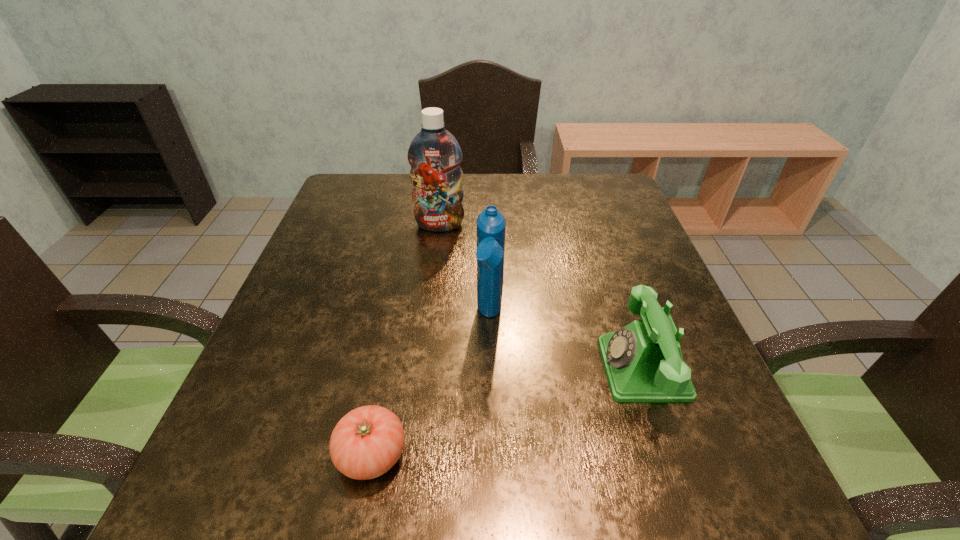
Locate an element on the screen. The height and width of the screenshot is (540, 960). vacant space at the near left corner of the desktop is located at coordinates (290, 513).

In order to click on vacant space in between the rightmost object and the farthest object in this screenshot , I will do `click(541, 297)`.

The width and height of the screenshot is (960, 540). I want to click on free space between the rightmost object and the tomato, so click(x=507, y=411).

Locate an element on the screen. The image size is (960, 540). vacant space that's between the third tallest object and the tomato is located at coordinates (507, 411).

Identify the location of free spot between the farther shampoo and the tomato. (406, 340).

Identify the location of vacant point located between the farthest object and the third tallest object. (541, 297).

Where is `vacant point located between the second shortest object and the shorter shampoo`? vacant point located between the second shortest object and the shorter shampoo is located at coordinates [x=566, y=342].

Image resolution: width=960 pixels, height=540 pixels. In order to click on free space between the tomato and the rightmost object in this screenshot , I will do `click(507, 411)`.

Find the location of a particular element. Image resolution: width=960 pixels, height=540 pixels. vacant space that's between the tomato and the taller shampoo is located at coordinates (406, 340).

Where is `free space between the rightmost object and the shortest object`? free space between the rightmost object and the shortest object is located at coordinates click(x=507, y=411).